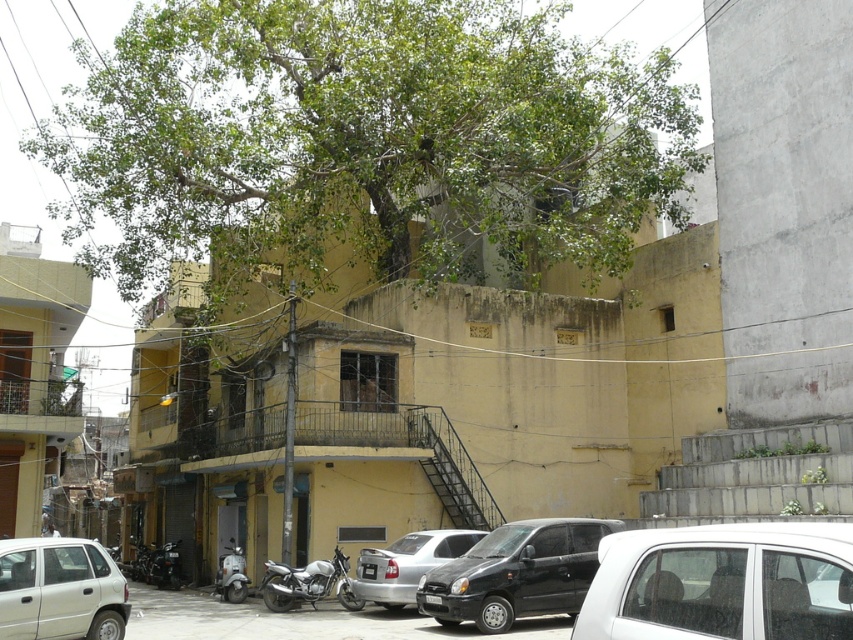
You are a pedestrian standing on the sidewalk and want to cross the street to reach the shiny black motorcycle at lower left. Is the white glossy car at center blocking your path?

The white glossy car at center is closer to the viewer than the shiny black motorcycle at lower left, so it is blocking the path to the shiny black motorcycle at lower left.